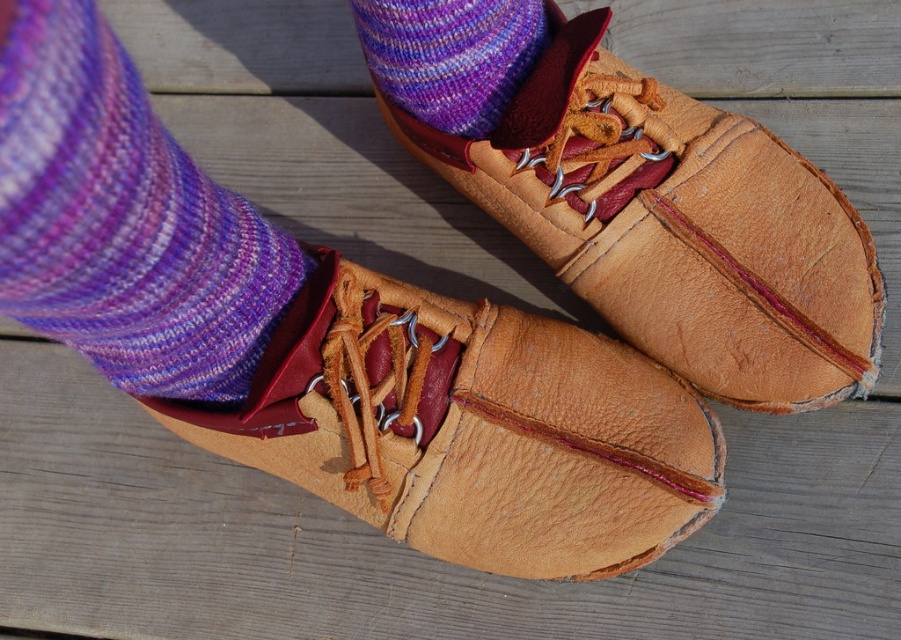
Does tan leather shoe at center have a smaller size compared to purple knitted sock at upper left?

No, tan leather shoe at center is not smaller than purple knitted sock at upper left.

Does tan leather shoe at center come behind purple knitted sock at upper left?

No, it is in front of purple knitted sock at upper left.

Identify the location of tan leather shoe at center. (471, 429).

Is point (469, 557) positioned in front of point (26, 86)?

That is False.

Can you confirm if tan leather shoe at center is shorter than purple knitted sock at lower left?

In fact, tan leather shoe at center may be taller than purple knitted sock at lower left.

Between point (284, 396) and point (83, 108), which one is positioned in front?

Point (83, 108)

The image size is (901, 640). Identify the location of tan leather shoe at center. (471, 429).

Is tan leather shoe at center wider than leather shoe at center?

Correct, the width of tan leather shoe at center exceeds that of leather shoe at center.

Does tan leather shoe at center appear on the right side of leather shoe at center?

No, tan leather shoe at center is not to the right of leather shoe at center.

Which is behind, point (334, 396) or point (642, 154)?

The point (642, 154) is behind.

Find the location of a particular element. The image size is (901, 640). tan leather shoe at center is located at coordinates (471, 429).